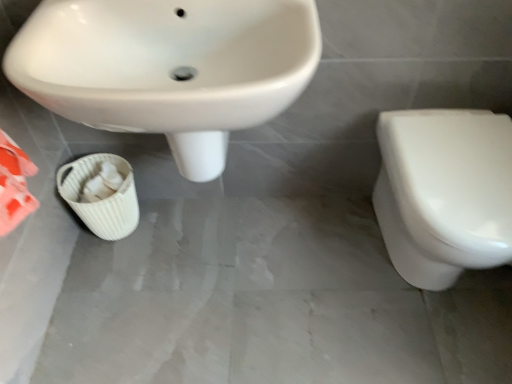
Question: In terms of width, does white glossy sink at upper left look wider or thinner when compared to white glossy toilet at right?

Choices:
 (A) wide
 (B) thin

Answer: (B)

Question: Considering the positions of white glossy sink at upper left and white glossy toilet at right in the image, is white glossy sink at upper left bigger or smaller than white glossy toilet at right?

Choices:
 (A) big
 (B) small

Answer: (A)

Question: Considering the real-world distances, which object is farthest from the white woven basket at lower left?

Choices:
 (A) white glossy toilet at right
 (B) white glossy sink at upper left

Answer: (A)

Question: Which of these objects is positioned farthest from the white woven basket at lower left?

Choices:
 (A) white glossy sink at upper left
 (B) white glossy toilet at right

Answer: (B)